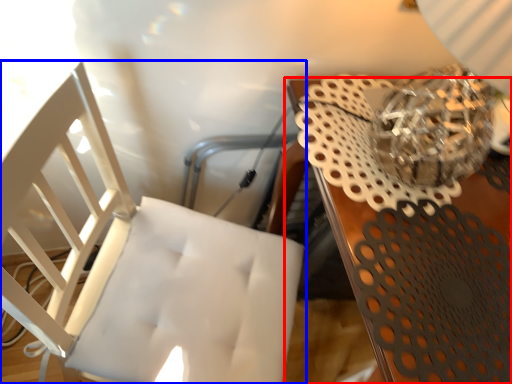
Question: Which object is further to the camera taking this photo, table (highlighted by a red box) or chair (highlighted by a blue box)?

Choices:
 (A) table
 (B) chair

Answer: (A)